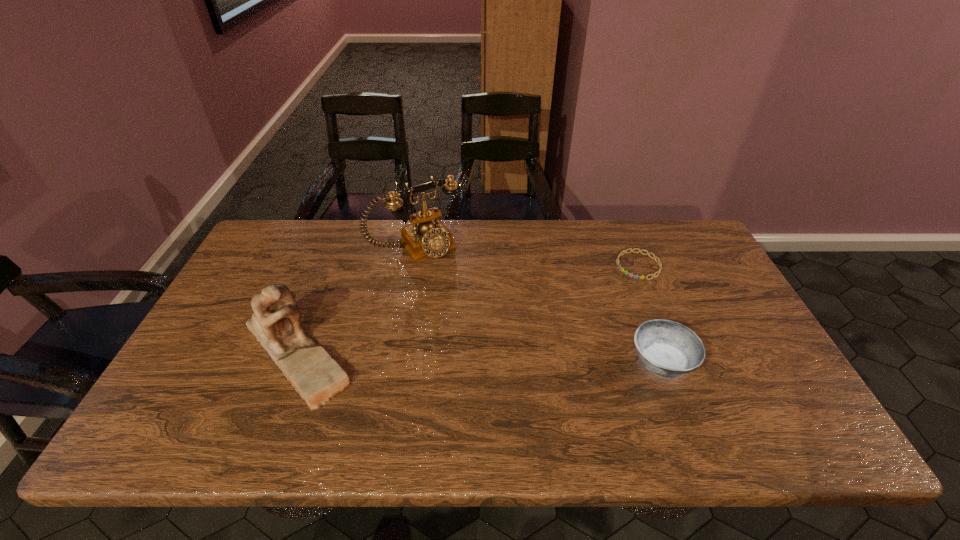
This screenshot has width=960, height=540. I want to click on figurine, so (x=276, y=324).

Where is `the second shortest object`? The width and height of the screenshot is (960, 540). the second shortest object is located at coordinates (668, 349).

I want to click on bracelet, so click(631, 275).

At what (x,y) coordinates should I click in order to perform the action: click on telephone. Please return your answer as a coordinate pair (x, y). This screenshot has height=540, width=960. Looking at the image, I should click on (427, 237).

The height and width of the screenshot is (540, 960). I want to click on vacant region located on the left of the ashtray, so click(573, 362).

The image size is (960, 540). Find the location of `vacant space situated on the surface of the bracelet showing star-shaped elements`. vacant space situated on the surface of the bracelet showing star-shaped elements is located at coordinates (616, 284).

The height and width of the screenshot is (540, 960). I want to click on vacant area situated 0.400m on the surface of the bracelet showing star-shaped elements, so click(x=540, y=346).

Where is `free space located on the surface of the bracelet showing star-shaped elements`? free space located on the surface of the bracelet showing star-shaped elements is located at coordinates (564, 326).

The height and width of the screenshot is (540, 960). Identify the location of vacant area located 0.370m on the dial number of the telephone. (497, 340).

Locate an element on the screen. This screenshot has height=540, width=960. vacant space located 0.060m on the dial number of the telephone is located at coordinates (445, 272).